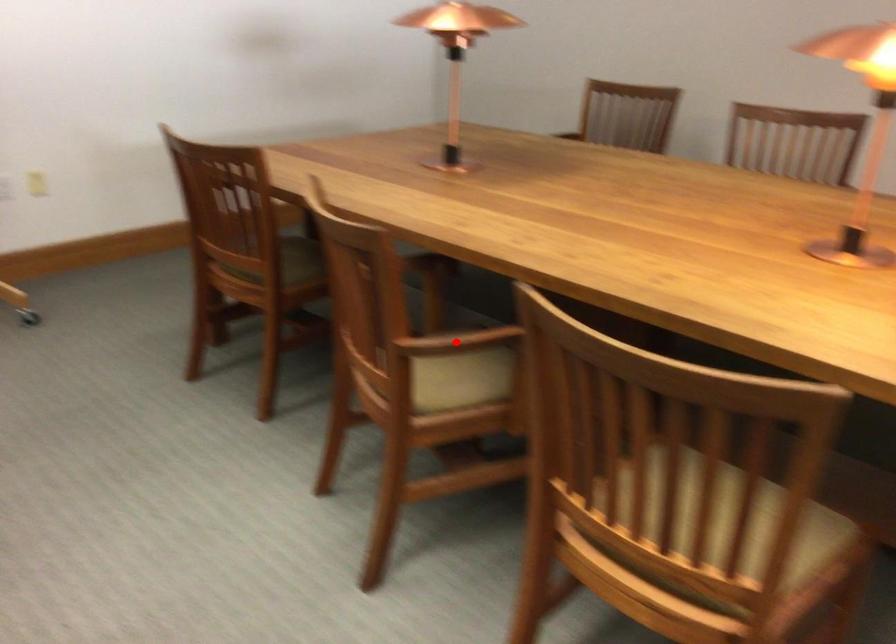
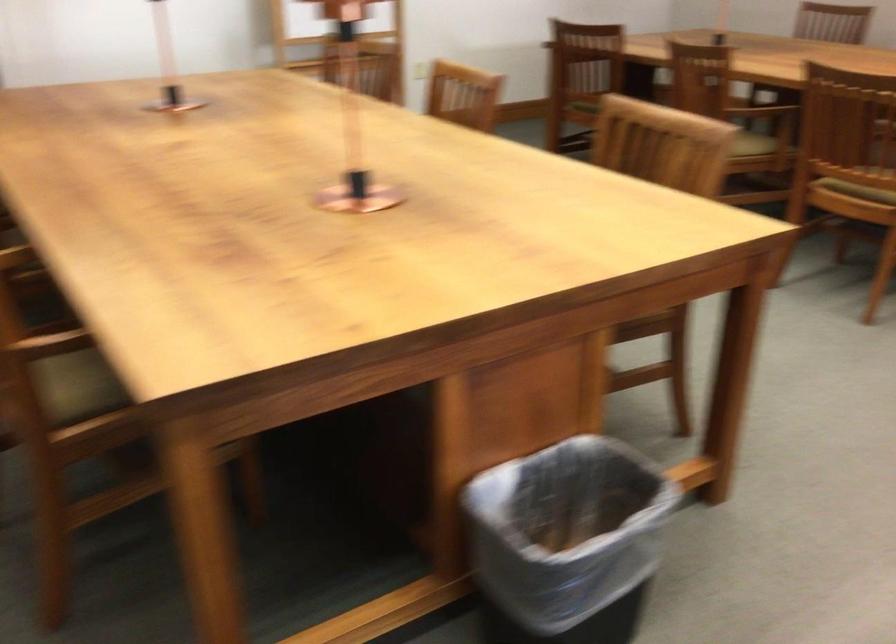
Question: I am providing you with two images of the same scene from different viewpoints. A red point is marked on the first image. Is the red point's position out of view in image 2?

Choices:
 (A) Yes
 (B) No

Answer: (A)